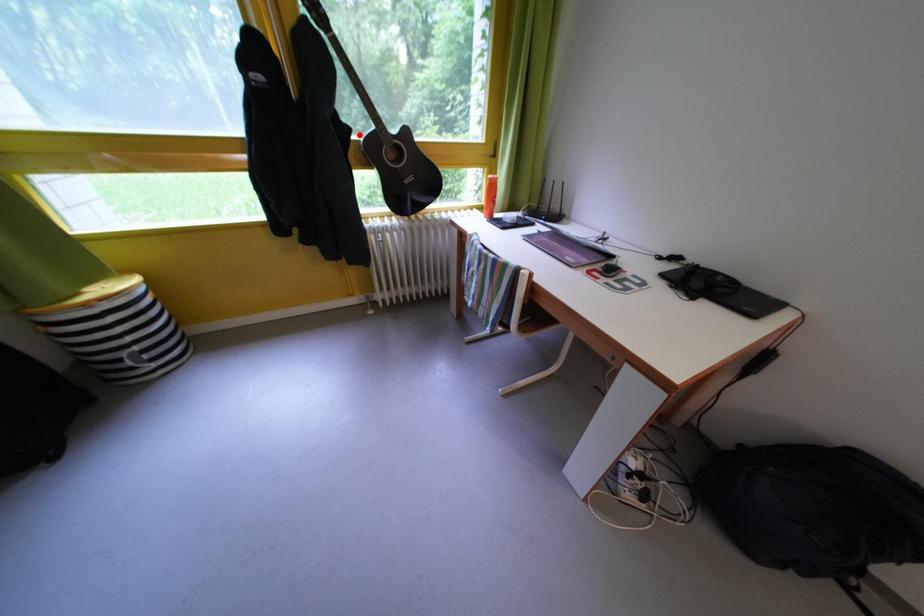
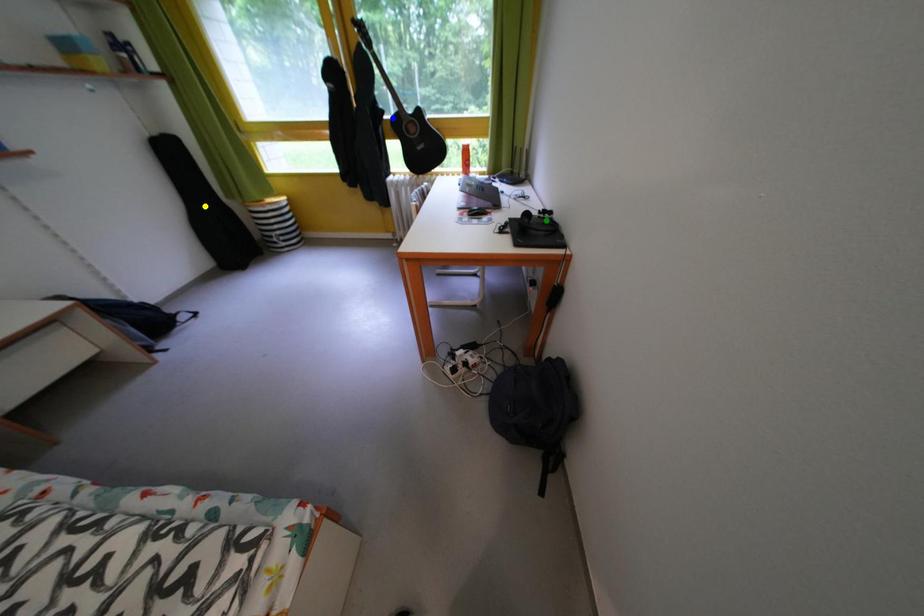
Question: I am providing you with two images of the same scene from different viewpoints. A red point is marked on the first image. You are given multiple points on the second image. Can you choose the point in image 2 that corresponds to the point in image 1?

Choices:
 (A) yellow point
 (B) blue point
 (C) green point

Answer: (B)